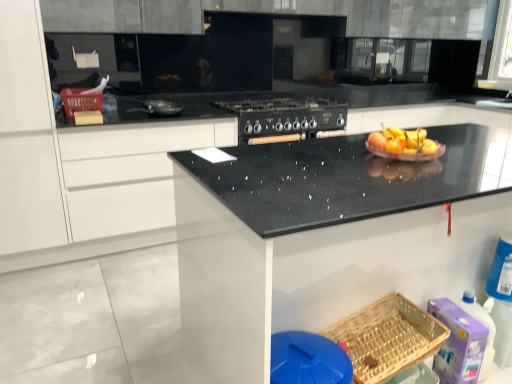
Locate an element on the screen. The image size is (512, 384). free point above purple plastic cleaning product at lower right (from a real-world perspective) is located at coordinates (452, 309).